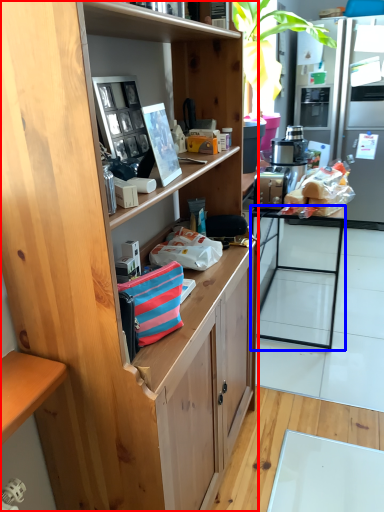
Question: Which object is further to the camera taking this photo, cabinetry (highlighted by a red box) or desk (highlighted by a blue box)?

Choices:
 (A) cabinetry
 (B) desk

Answer: (B)